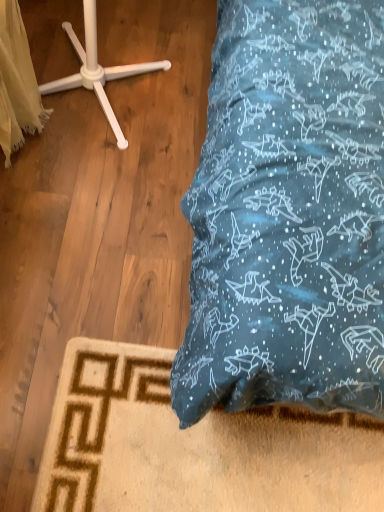
Find the location of a particular element. space that is in front of white plastic coat stand at upper left is located at coordinates [97, 199].